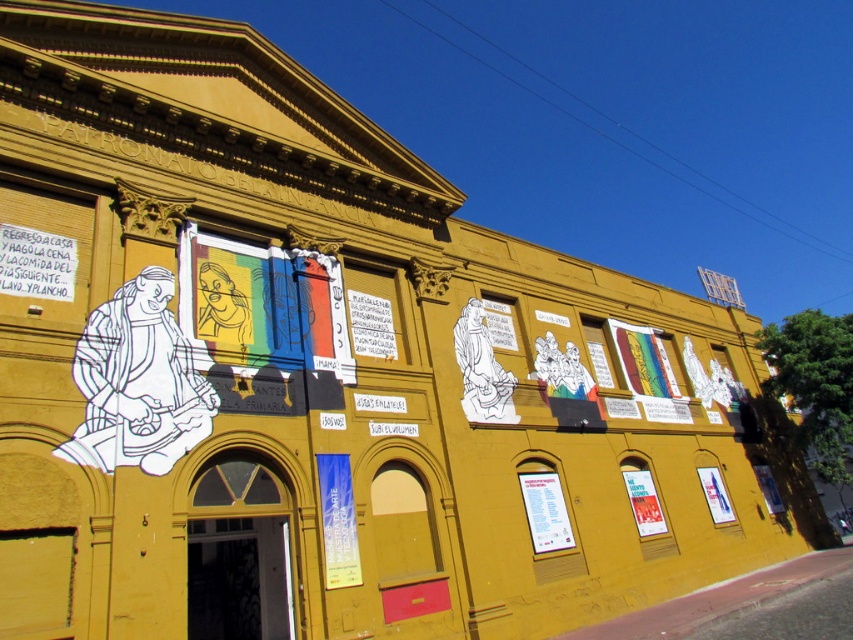
Does matte paper poster at lower right have a lesser height compared to matte white poster at lower right?

Incorrect, matte paper poster at lower right's height does not fall short of matte white poster at lower right's.

Does matte paper poster at lower right have a greater width compared to matte white poster at lower right?

In fact, matte paper poster at lower right might be narrower than matte white poster at lower right.

Is point (630, 500) more distant than point (712, 483)?

No, it is in front of (712, 483).

The image size is (853, 640). I want to click on matte paper poster at lower right, so click(643, 500).

Which is above, white paper poster at upper left or white paper poster at center?

white paper poster at upper left

Does white paper poster at upper left lie behind white paper poster at center?

No, it is not.

Between point (48, 292) and point (537, 481), which one is positioned in front?

Point (48, 292) is in front.

I want to click on white paper poster at upper left, so pos(36,262).

Between white paper poster at center and matte white poster at lower right, which one has less height?

Standing shorter between the two is matte white poster at lower right.

You are a GUI agent. You are given a task and a screenshot of the screen. Output one action in this format:
    pyautogui.click(x=<x>, y=<y>)
    Task: Click on the white paper poster at center
    The height and width of the screenshot is (640, 853).
    Given the screenshot: What is the action you would take?
    click(x=544, y=512)